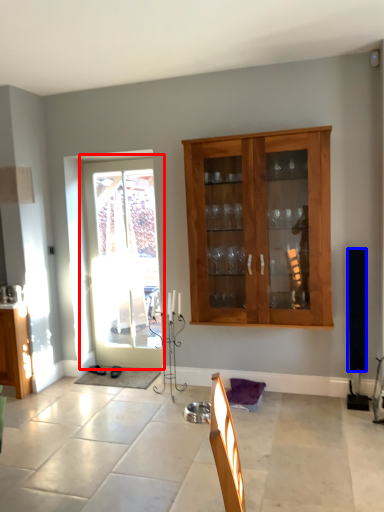
Question: Which point is closer to the camera, door (highlighted by a red box) or loudspeaker (highlighted by a blue box)?

Choices:
 (A) door
 (B) loudspeaker

Answer: (B)